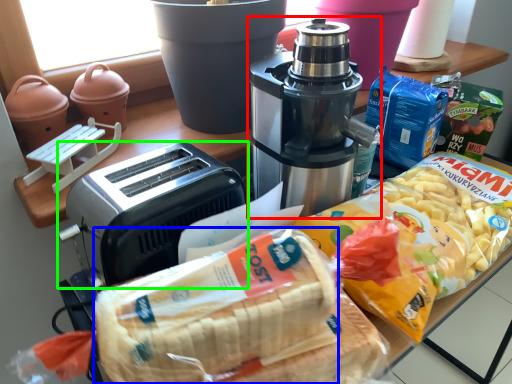
Question: Which is nearer to the coffee maker (highlighted by a red box)? treat (highlighted by a blue box) or toaster (highlighted by a green box).

Choices:
 (A) treat
 (B) toaster

Answer: (B)